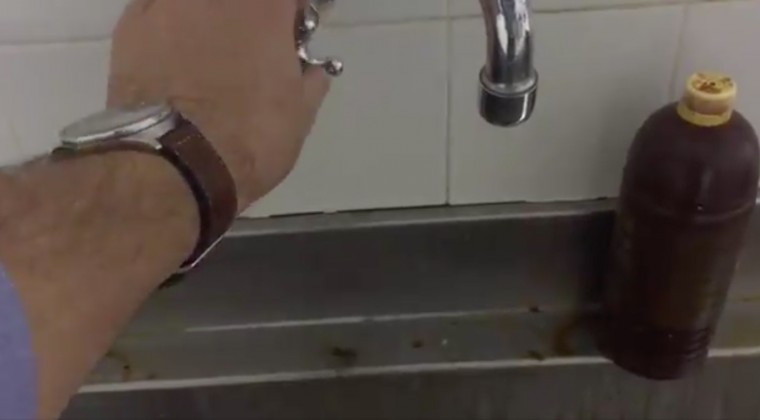
Image resolution: width=760 pixels, height=420 pixels. Find the location of `sink`. sink is located at coordinates (435, 336).